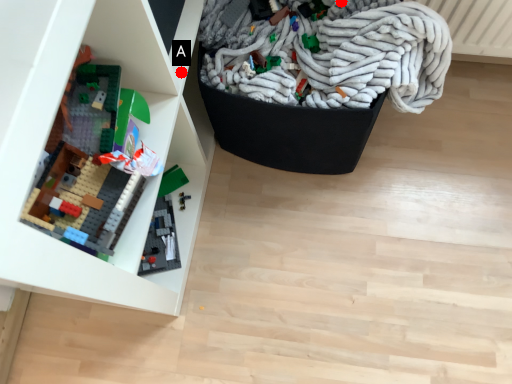
Question: Two points are circled on the image, labeled by A and B beside each circle. Which of the following is the closest to the observer?

Choices:
 (A) A is closer
 (B) B is closer

Answer: (A)